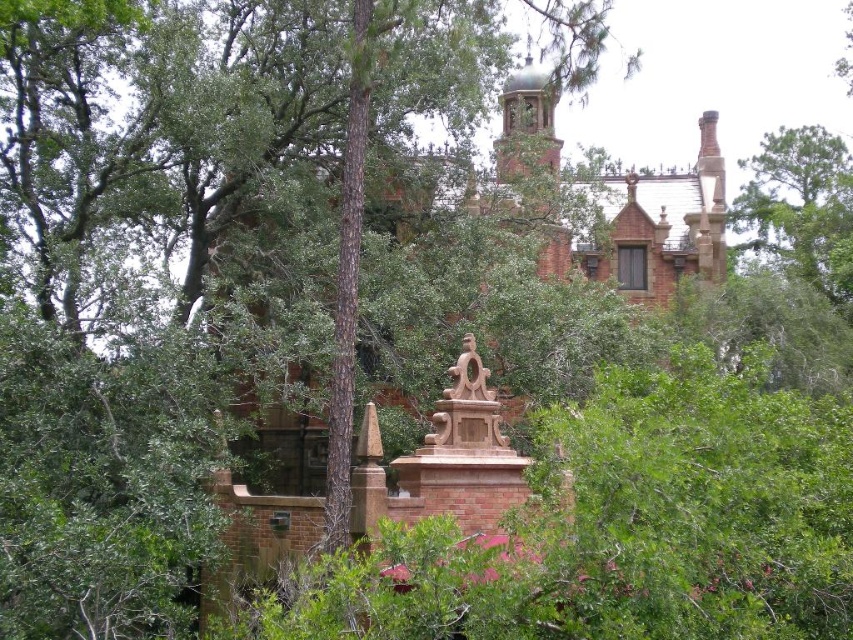
Can you confirm if green leafy tree at upper right is taller than carved stone statue at center?

Yes, green leafy tree at upper right is taller than carved stone statue at center.

Based on the photo, does green leafy tree at upper right have a larger size compared to carved stone statue at center?

Yes.

Measure the distance between point (766, 168) and camera.

Point (766, 168) and camera are 148.94 meters apart.

This screenshot has width=853, height=640. I want to click on green leafy tree at upper right, so click(x=799, y=209).